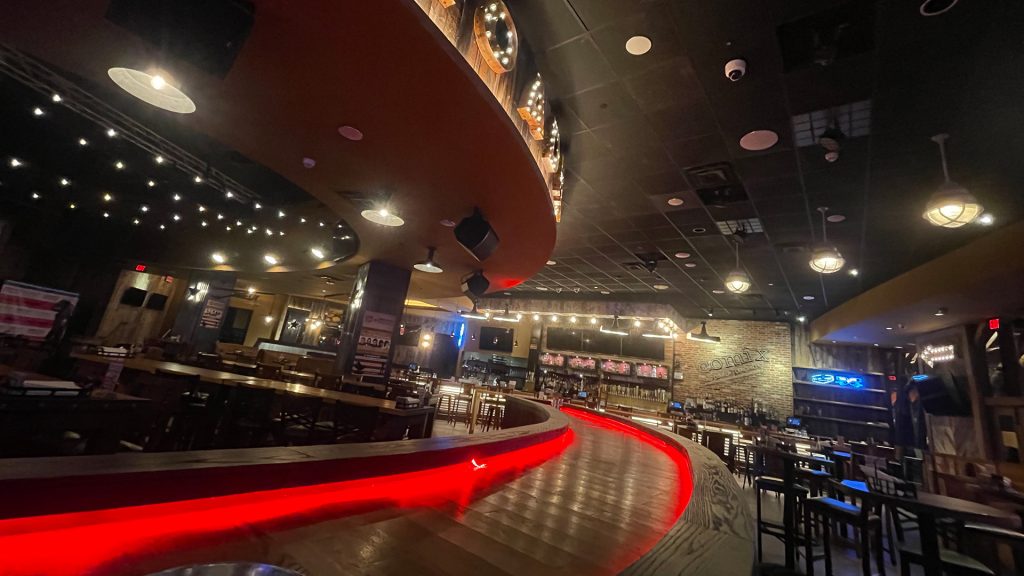
Identify the location of light. (947, 210).